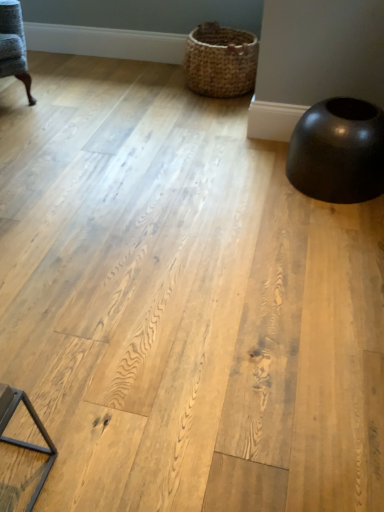
Find the location of a particular element. The image size is (384, 512). vacant area that is in front of woven brown basket at upper center is located at coordinates (193, 113).